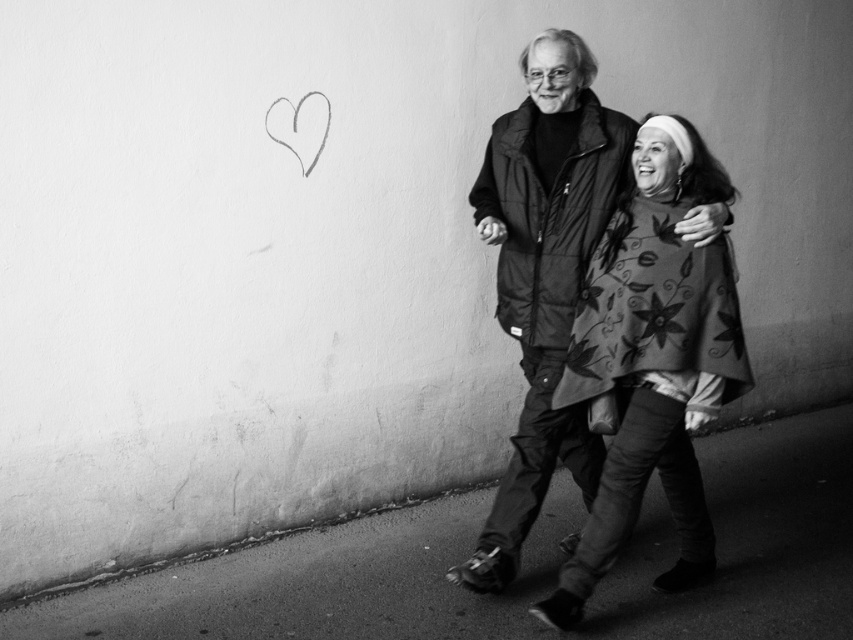
You are standing at the origin point of the coordinate system in the image. You want to walk to the smooth asphalt at lower center. What coordinates should you head towards?

You should head towards the coordinates point at (521, 564) to reach the smooth asphalt at lower center.